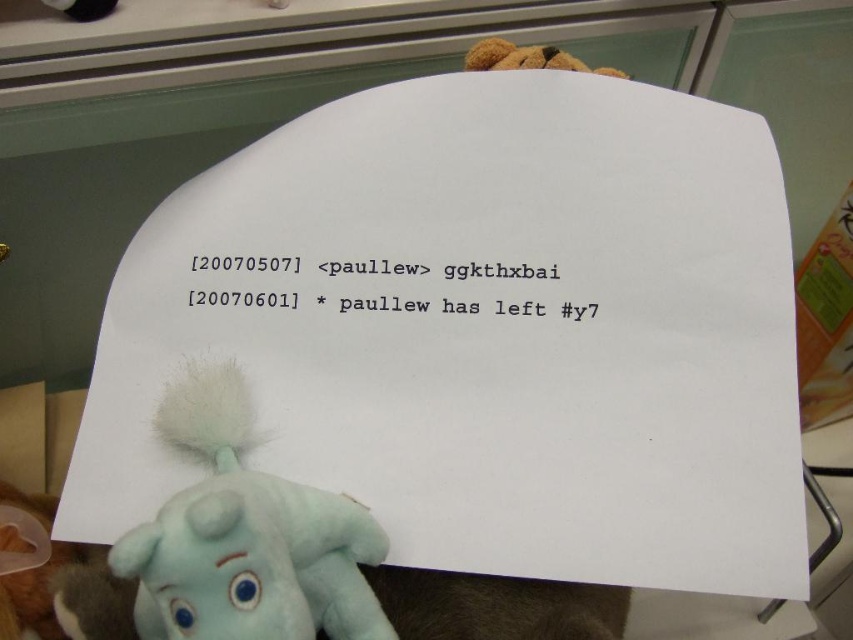
Which of these two, blue plush toy at lower left or brown plush bear at upper center, stands taller?

blue plush toy at lower left

Is the position of blue plush toy at lower left more distant than that of brown plush bear at upper center?

That is False.

Which is behind, point (171, 618) or point (490, 49)?

The point (490, 49) is more distant.

Locate an element on the screen. blue plush toy at lower left is located at coordinates (247, 536).

Between blue plush toy at lower left and blacktextured papernote at upper center, which one is positioned lower?

blue plush toy at lower left is below.

Does blue plush toy at lower left have a larger size compared to blacktextured papernote at upper center?

Yes.

This screenshot has height=640, width=853. Identify the location of blue plush toy at lower left. (247, 536).

Locate an element on the screen. This screenshot has width=853, height=640. blue plush toy at lower left is located at coordinates (247, 536).

Who is lower down, blacktextured papernote at upper center or brown plush bear at upper center?

blacktextured papernote at upper center is below.

Find the location of a particular element. blacktextured papernote at upper center is located at coordinates (438, 275).

Is point (392, 276) more distant than point (466, 52)?

No, (392, 276) is closer to viewer.

You are a GUI agent. You are given a task and a screenshot of the screen. Output one action in this format:
    pyautogui.click(x=<x>, y=<y>)
    Task: Click on the blacktextured papernote at upper center
    The image size is (853, 640).
    Given the screenshot: What is the action you would take?
    pyautogui.click(x=438, y=275)